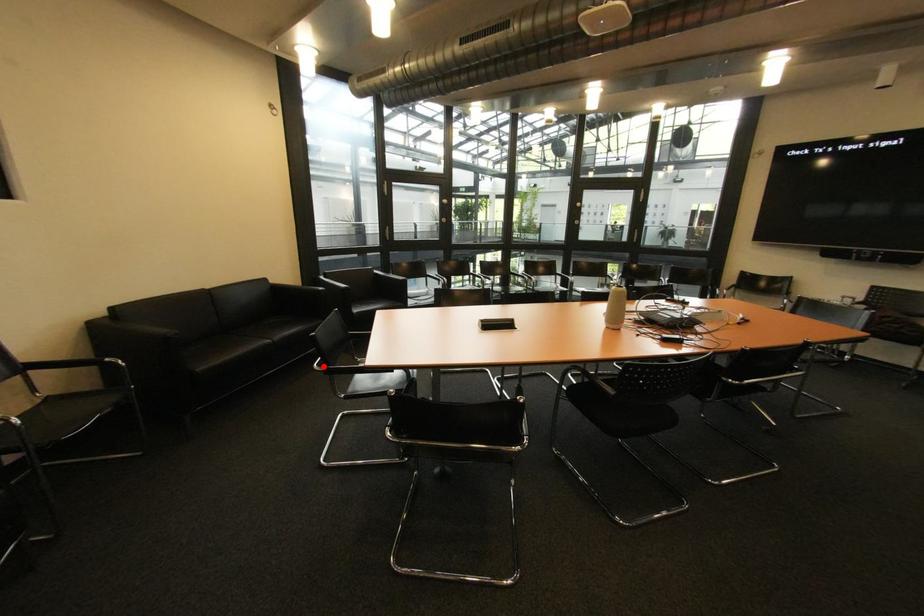
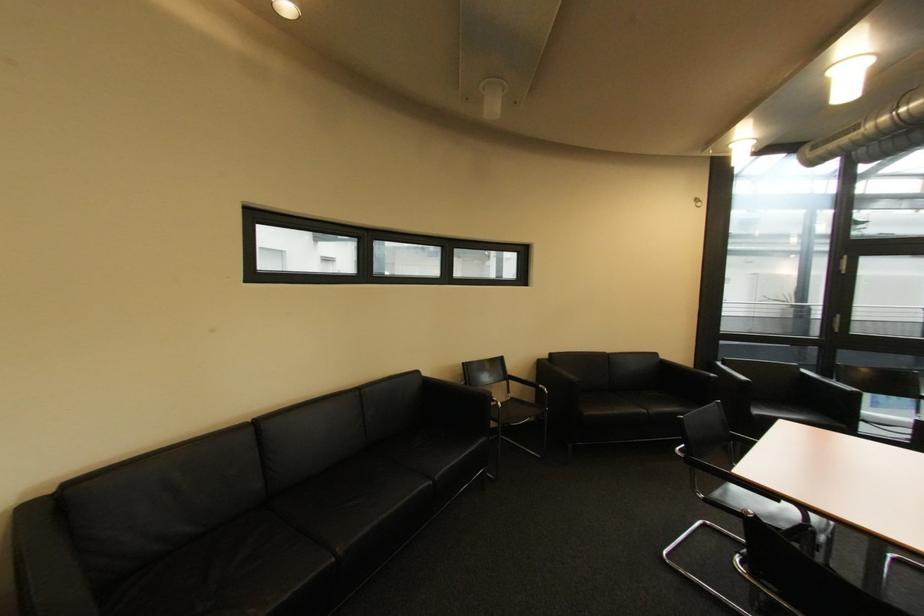
In the second image, find the point that corresponds to the highlighted location in the first image.

(686, 450)